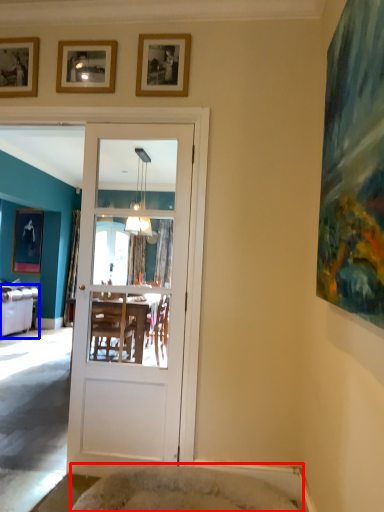
Question: Which of the following is the closest to the observer, cat bed (highlighted by a red box) or studio couch (highlighted by a blue box)?

Choices:
 (A) cat bed
 (B) studio couch

Answer: (A)